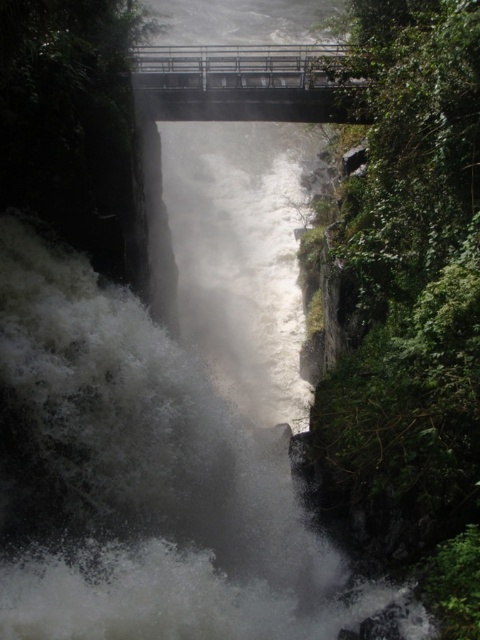
Can you confirm if white frothy water at center is positioned to the left of metallic bridge at upper center?

No, white frothy water at center is not to the left of metallic bridge at upper center.

Locate an element on the screen. The image size is (480, 640). white frothy water at center is located at coordinates (140, 481).